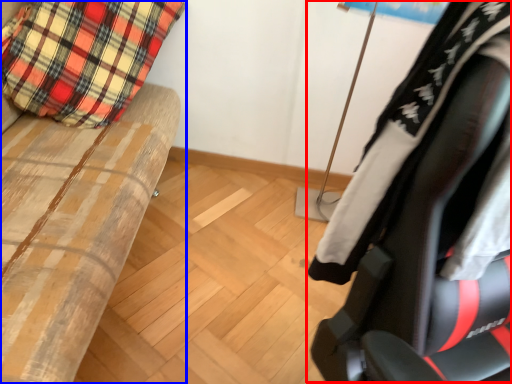
Question: Which object is closer to the camera taking this photo, chair (highlighted by a red box) or furniture (highlighted by a blue box)?

Choices:
 (A) chair
 (B) furniture

Answer: (A)